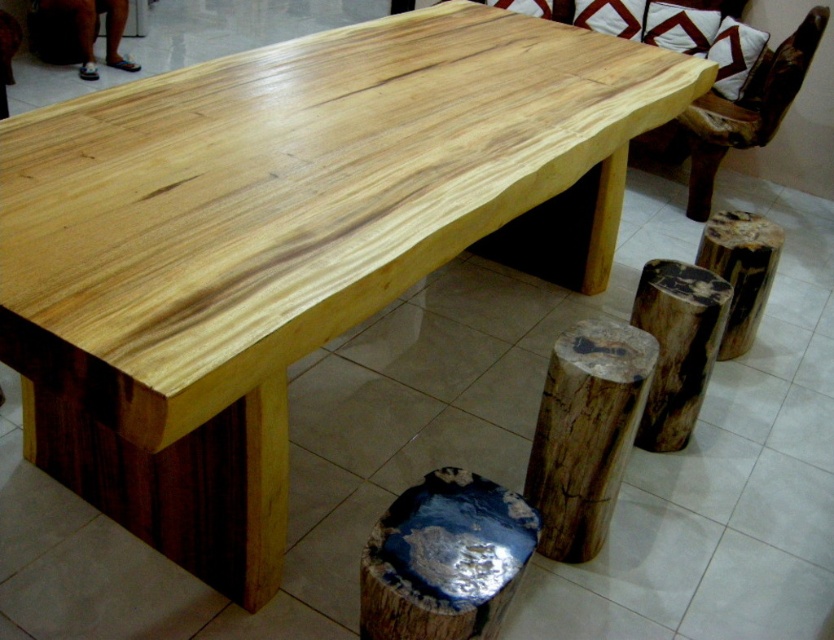
Is blue polished wood stool at lower center smaller than dark brown wood log at lower right?

Yes, blue polished wood stool at lower center is smaller than dark brown wood log at lower right.

Consider the image. How much distance is there between blue polished wood stool at lower center and dark brown wood log at lower right?

The distance of blue polished wood stool at lower center from dark brown wood log at lower right is 1.41 meters.

Locate an element on the screen. The image size is (834, 640). blue polished wood stool at lower center is located at coordinates (445, 557).

Based on the photo, is natural wood log at lower center smaller than natural wood log at lower right?

Incorrect, natural wood log at lower center is not smaller in size than natural wood log at lower right.

Can you confirm if natural wood log at lower center is taller than natural wood log at lower right?

Indeed, natural wood log at lower center has a greater height compared to natural wood log at lower right.

Describe the element at coordinates (585, 433) in the screenshot. I see `natural wood log at lower center` at that location.

The height and width of the screenshot is (640, 834). Find the location of `natural wood log at lower center`. natural wood log at lower center is located at coordinates (585, 433).

From the picture: Who is taller, natural wood log at lower center or dark brown wood log at lower right?

With more height is natural wood log at lower center.

Describe the element at coordinates (585, 433) in the screenshot. Image resolution: width=834 pixels, height=640 pixels. I see `natural wood log at lower center` at that location.

Where is `natural wood log at lower center`? The image size is (834, 640). natural wood log at lower center is located at coordinates (585, 433).